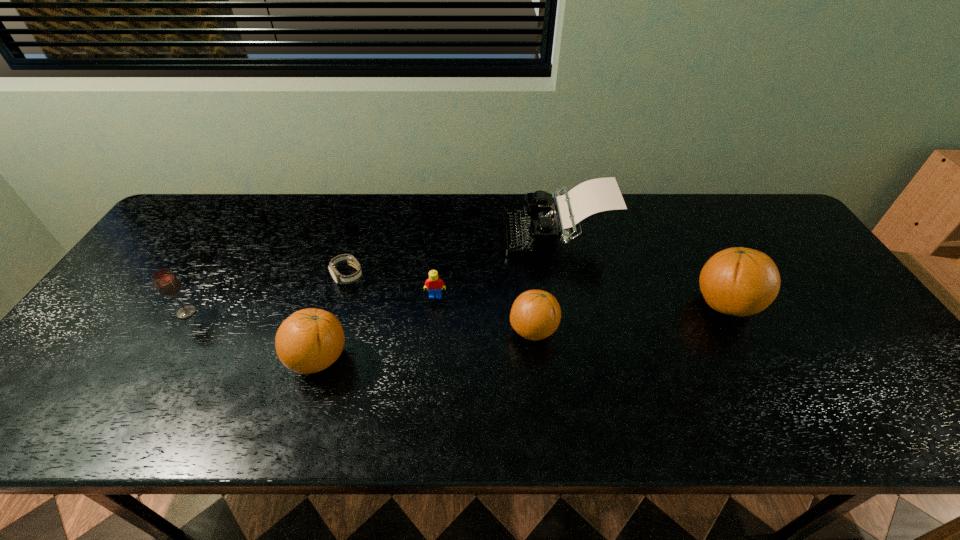
In the image, there is a desktop. Identify the location of vacant space at the near edge. The height and width of the screenshot is (540, 960). (690, 386).

This screenshot has width=960, height=540. Find the location of `vacant space at the right edge of the desktop`. vacant space at the right edge of the desktop is located at coordinates (847, 352).

Find the location of a particular element. vacant space at the far left corner is located at coordinates pos(222,220).

Identify the location of vacant space at the near left corner of the desktop. (127, 360).

Where is `vacant space at the far right corner`? vacant space at the far right corner is located at coordinates (778, 232).

You are a GUI agent. You are given a task and a screenshot of the screen. Output one action in this format:
    pyautogui.click(x=<x>, y=<y>)
    Task: Click on the vacant area between the sixth tallest object and the rightmost orange
    The width and height of the screenshot is (960, 540).
    Given the screenshot: What is the action you would take?
    pyautogui.click(x=581, y=300)

Where is `vacant area that lies between the shortest orange and the leftmost object`? The width and height of the screenshot is (960, 540). vacant area that lies between the shortest orange and the leftmost object is located at coordinates (360, 321).

Identify the location of free space between the rightmost orange and the sixth tallest object. The image size is (960, 540). (581, 300).

You are a GUI agent. You are given a task and a screenshot of the screen. Output one action in this format:
    pyautogui.click(x=<x>, y=<y>)
    Task: Click on the vacant area that lies between the leftmost object and the second orange from left to right
    This screenshot has width=960, height=540.
    Given the screenshot: What is the action you would take?
    pyautogui.click(x=360, y=321)

In order to click on blank region between the typewriter and the watch in this screenshot , I will do `click(452, 255)`.